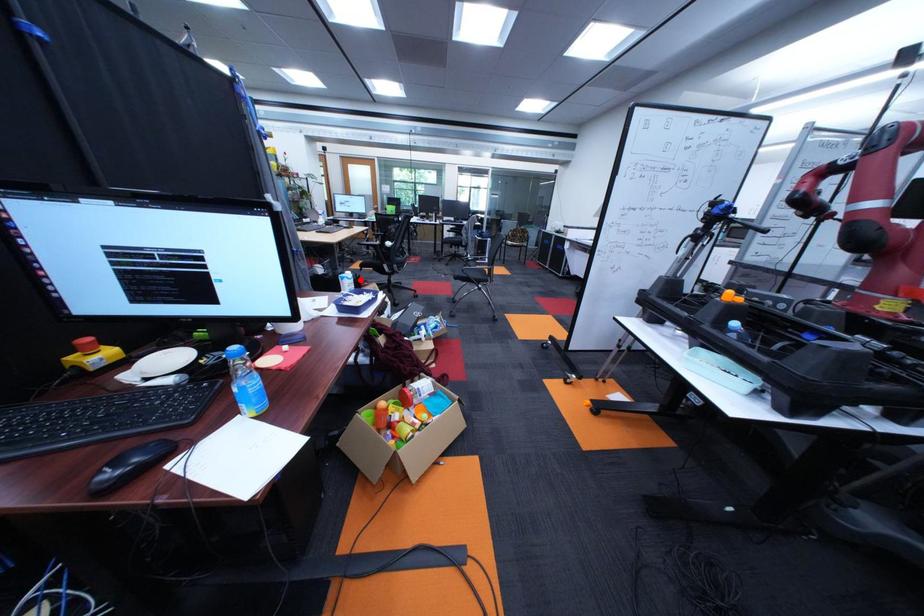
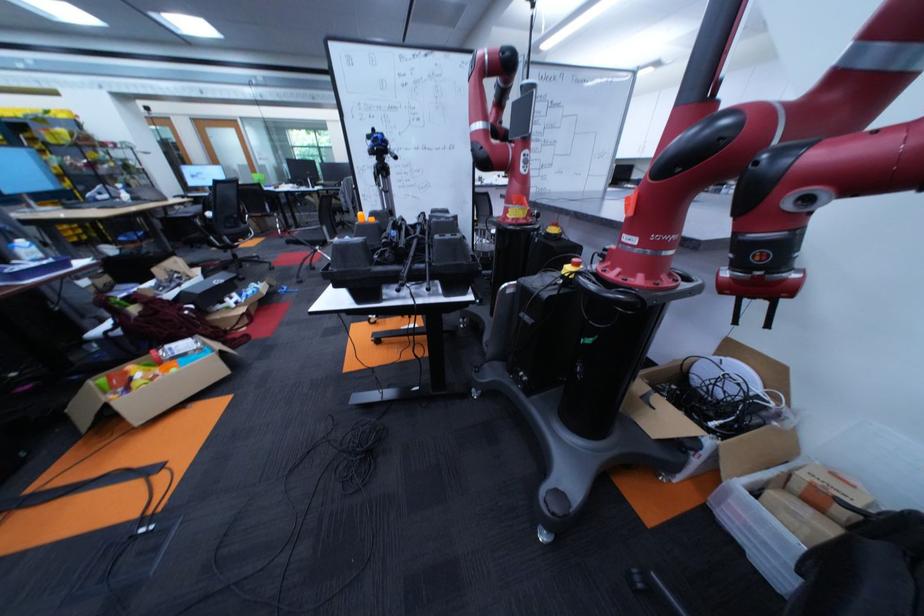
Locate, in the second image, the point that corresponds to the highlighted location in the first image.

(40, 249)